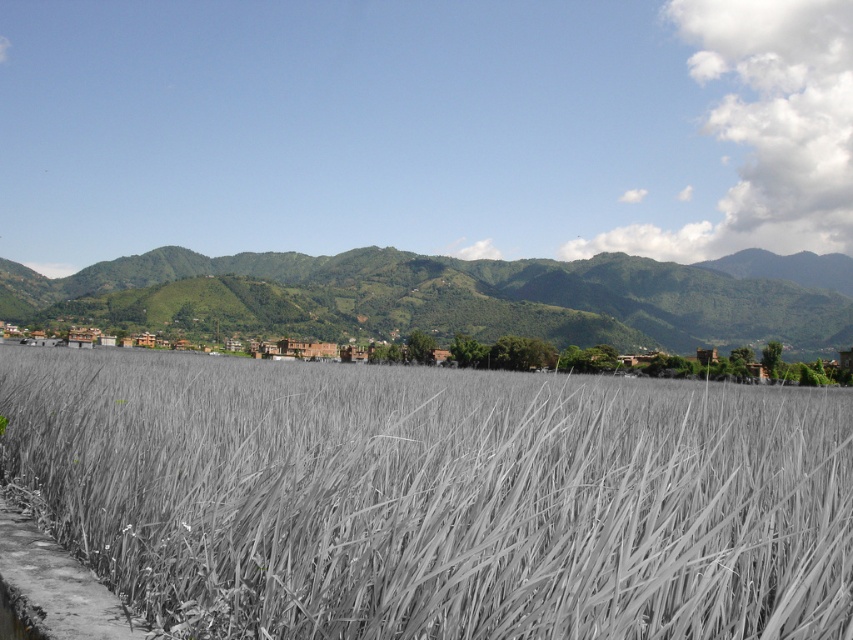
Consider the image. You are a farmer planning to plant crops in the gray matte rice field at center and the green leafy mountain at center. Which area has more space for planting?

The gray matte rice field at center has a lesser width compared to the green leafy mountain at center, so the green leafy mountain at center has more space for planting.

You are standing in a rural area and see the gray matte rice field at center and the green leafy mountain at center. Which one is nearer to you?

The gray matte rice field at center is closer to the viewer than the green leafy mountain at center.

Consider the image. You are standing in the middle of the gray matte rice field at center and want to walk towards the green leafy mountain at center. Which direction should you head?

The gray matte rice field at center is located below the green leafy mountain at center, so you should head upwards to reach the green leafy mountain at center.